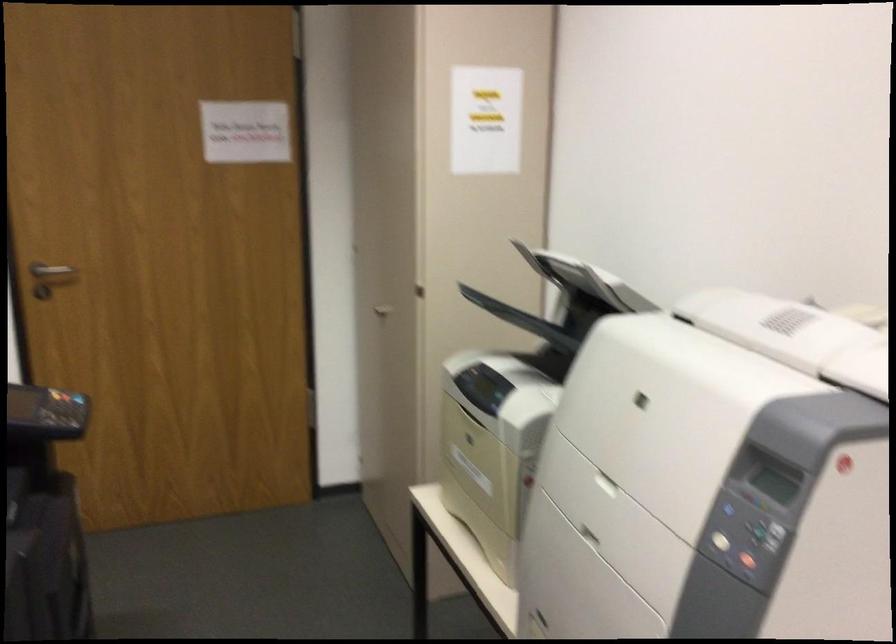
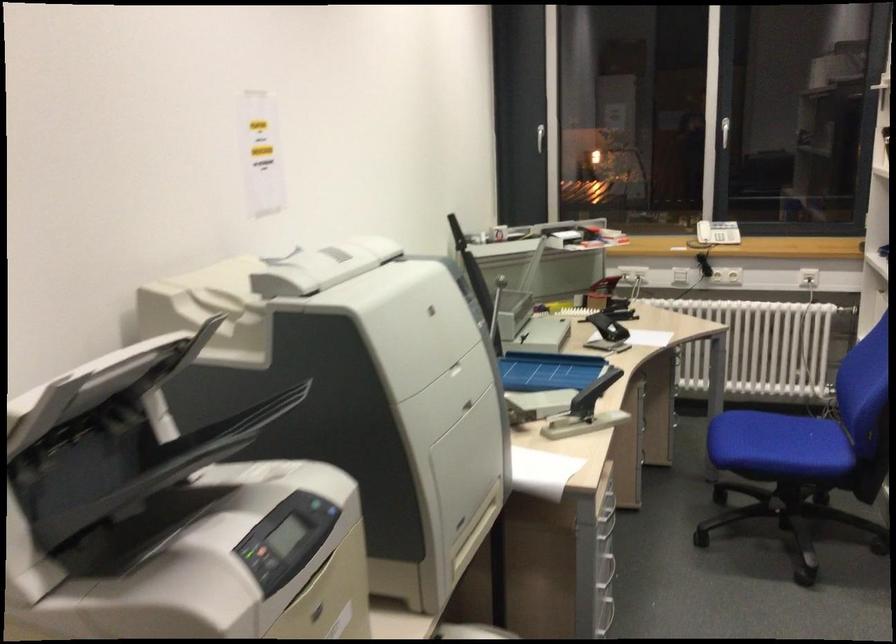
The point at (524,401) is marked in the first image. Where is the corresponding point in the second image?

(278, 543)